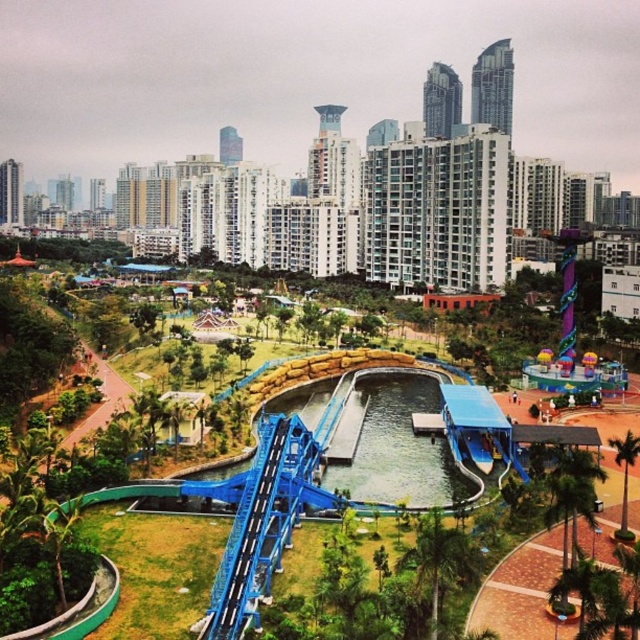
You are standing at the point with coordinates (440, 563) in the park. What object are you directly in front of?

You are directly in front of the green leafy palm tree at center.

You are a park visitor standing at the entrance of the park. You see the blue glossy water slide at center and the green leafy palm tree at center. Which object is closer to you?

The blue glossy water slide at center is positioned over the green leafy palm tree at center, so the water slide is closer to you.